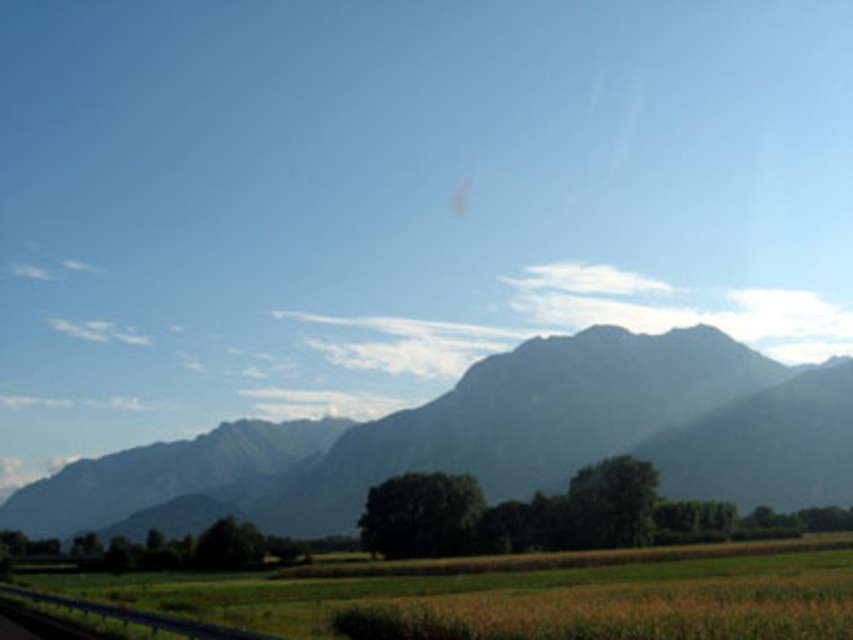
Does gray rocky mountain at center appear under brown grassy field at lower center?

Correct, gray rocky mountain at center is located below brown grassy field at lower center.

Does point (727, 380) come in front of point (490, 604)?

No, it is not.

Find the location of a particular element. gray rocky mountain at center is located at coordinates (502, 440).